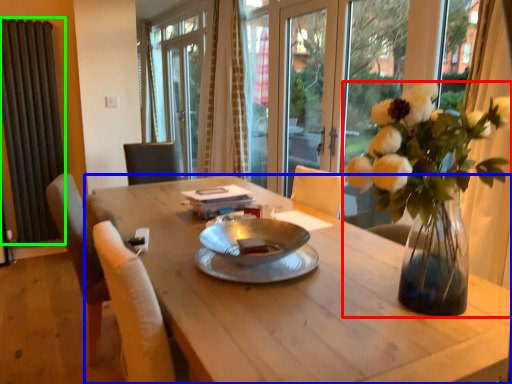
Question: Which object is positioned farthest from houseplant (highlighted by a red box)? Select from desk (highlighted by a blue box) and radiator (highlighted by a green box).

Choices:
 (A) desk
 (B) radiator

Answer: (B)